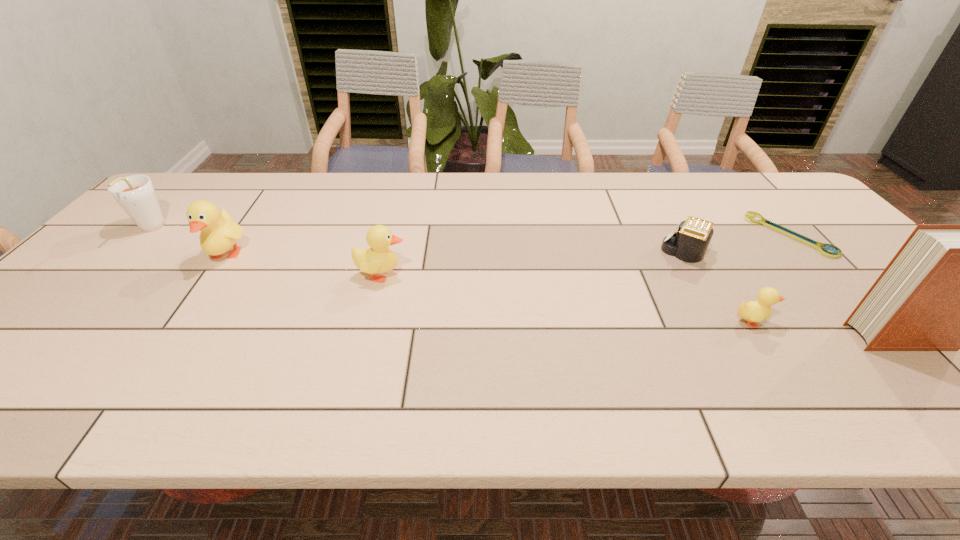
Locate an element on the screen. the sixth object from right to left is located at coordinates (219, 232).

What are the coordinates of `the second shortest duckling` in the screenshot? It's located at (378, 258).

At what (x,y) coordinates should I click in order to perform the action: click on the fourth tallest object. Please return your answer as a coordinate pair (x, y). This screenshot has height=540, width=960. Looking at the image, I should click on (378, 258).

The width and height of the screenshot is (960, 540). In order to click on the rightmost duckling in this screenshot , I will do `click(753, 311)`.

This screenshot has width=960, height=540. In order to click on the nearest duckling in this screenshot , I will do `click(753, 311)`.

Find the location of a particular element. wrench is located at coordinates (750, 215).

What are the coordinates of `root beer` in the screenshot? It's located at (135, 194).

Locate an element on the screen. calculator is located at coordinates (689, 244).

At what (x,y) coordinates should I click in order to perform the action: click on free point located 0.090m on the front-facing side of the leftmost duckling. Please return your answer as a coordinate pair (x, y). Looking at the image, I should click on (197, 297).

You are a GUI agent. You are given a task and a screenshot of the screen. Output one action in this format:
    pyautogui.click(x=<x>, y=<y>)
    Task: Click on the vacant region located 0.270m on the front-facing side of the second duckling from right to left
    This screenshot has height=540, width=960.
    Given the screenshot: What is the action you would take?
    pyautogui.click(x=512, y=275)